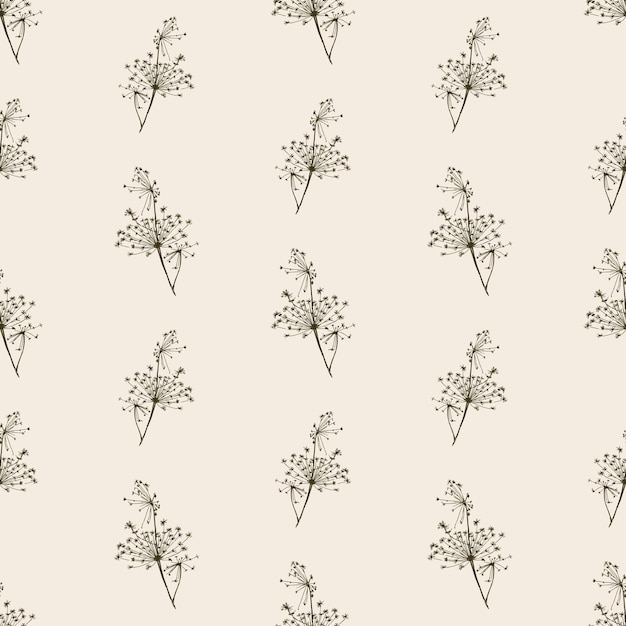
Where is `creme tone background`? This screenshot has width=626, height=626. creme tone background is located at coordinates (387, 436).